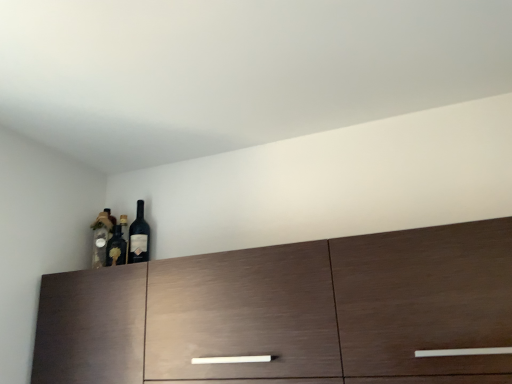
Question: Is the surface of dark wood cabinet at center in direct contact with matte glass bottle at left?

Choices:
 (A) no
 (B) yes

Answer: (A)

Question: Is dark wood cabinet at center oriented away from matte glass bottle at left?

Choices:
 (A) no
 (B) yes

Answer: (A)

Question: From a real-world perspective, does dark wood cabinet at center stand above matte glass bottle at left?

Choices:
 (A) yes
 (B) no

Answer: (B)

Question: Is dark wood cabinet at center to the left of matte glass bottle at left from the viewer's perspective?

Choices:
 (A) yes
 (B) no

Answer: (B)

Question: Can you confirm if dark wood cabinet at center is wider than matte glass bottle at left?

Choices:
 (A) no
 (B) yes

Answer: (B)

Question: In the image, is matte glass wine bottle at upper left on the left side or the right side of dark wood cabinet at center?

Choices:
 (A) right
 (B) left

Answer: (B)

Question: Is matte glass wine bottle at upper left situated inside dark wood cabinet at center or outside?

Choices:
 (A) outside
 (B) inside

Answer: (A)

Question: From the image's perspective, is matte glass wine bottle at upper left located above or below dark wood cabinet at center?

Choices:
 (A) below
 (B) above

Answer: (B)

Question: Does point (138, 211) appear closer or farther from the camera than point (390, 301)?

Choices:
 (A) closer
 (B) farther

Answer: (B)

Question: Is dark wood cabinet at center spatially inside matte glass bottle at left, or outside of it?

Choices:
 (A) inside
 (B) outside

Answer: (B)

Question: In terms of size, does dark wood cabinet at center appear bigger or smaller than matte glass bottle at left?

Choices:
 (A) small
 (B) big

Answer: (B)

Question: Considering the positions of point (166, 372) and point (91, 223), is point (166, 372) closer or farther from the camera than point (91, 223)?

Choices:
 (A) farther
 (B) closer

Answer: (B)

Question: Is dark wood cabinet at center in front of or behind matte glass bottle at left in the image?

Choices:
 (A) front
 (B) behind

Answer: (A)

Question: From their relative heights in the image, would you say dark wood cabinet at center is taller or shorter than matte glass wine bottle at upper left?

Choices:
 (A) short
 (B) tall

Answer: (B)

Question: Is point (334, 369) closer or farther from the camera than point (137, 233)?

Choices:
 (A) farther
 (B) closer

Answer: (B)